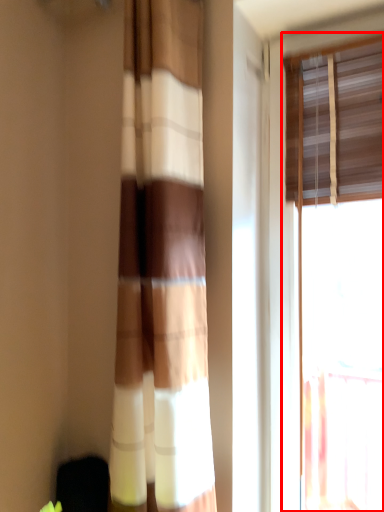
Question: From the image, what is the correct spatial relationship of window (annotated by the red box) in relation to curtain?

Choices:
 (A) left
 (B) right

Answer: (B)